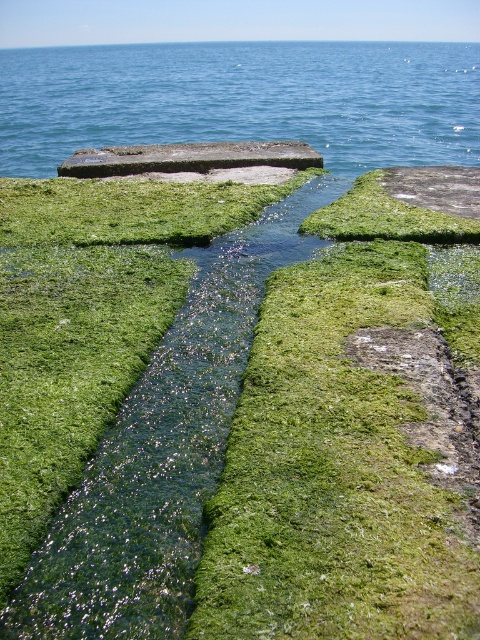
Which is above, blue water at upper center or smooth concrete slab at center?

blue water at upper center is higher up.

Which is behind, point (205, 113) or point (284, 156)?

Positioned behind is point (205, 113).

Where is `blue water at upper center`? The height and width of the screenshot is (640, 480). blue water at upper center is located at coordinates (243, 100).

Measure the distance between green mossy grass at center and smooth concrete slab at center.

green mossy grass at center and smooth concrete slab at center are 7.08 meters apart.

Where is `green mossy grass at center`? The height and width of the screenshot is (640, 480). green mossy grass at center is located at coordinates pyautogui.click(x=85, y=321).

Between blue water at upper center and green mossy grass at center, which one is positioned higher?

Positioned higher is blue water at upper center.

What do you see at coordinates (243, 100) in the screenshot? This screenshot has width=480, height=640. I see `blue water at upper center` at bounding box center [243, 100].

Image resolution: width=480 pixels, height=640 pixels. I want to click on blue water at upper center, so click(243, 100).